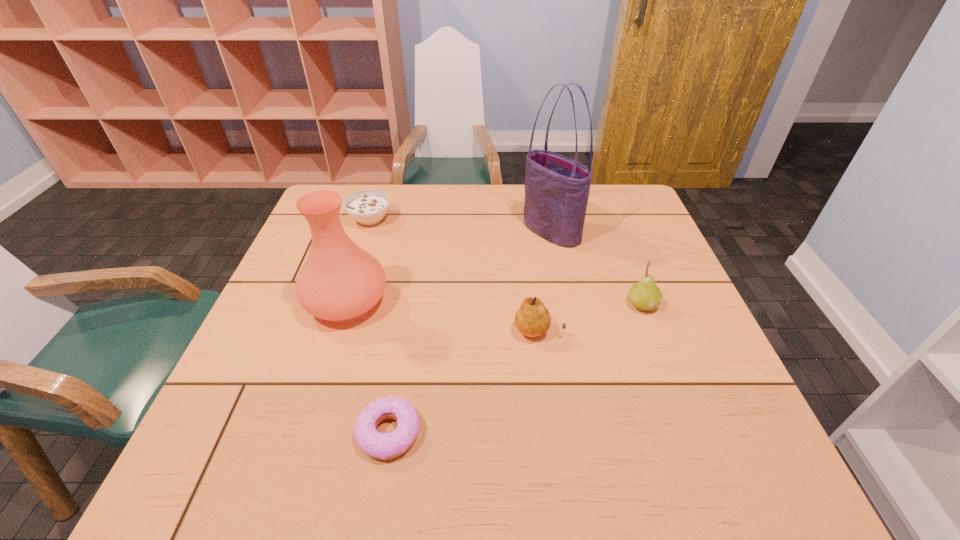
Find the location of a particular element. Image resolution: width=960 pixels, height=540 pixels. tote bag is located at coordinates (557, 188).

The image size is (960, 540). I want to click on the fifth shortest object, so click(x=340, y=282).

Where is `the rightmost object`? the rightmost object is located at coordinates (644, 295).

Where is `the farther pear`? This screenshot has width=960, height=540. the farther pear is located at coordinates click(644, 295).

Where is `the left pear`? This screenshot has height=540, width=960. the left pear is located at coordinates (532, 319).

Where is `the nearer pear`? the nearer pear is located at coordinates (532, 319).

Find the location of a particular element. Image resolution: width=960 pixels, height=540 pixels. the fifth tallest object is located at coordinates (368, 207).

Where is `the nearest object`? This screenshot has height=540, width=960. the nearest object is located at coordinates (375, 444).

I want to click on doughnut, so click(375, 444).

The image size is (960, 540). Identify the location of free space located on the front of the tote bag. (557, 262).